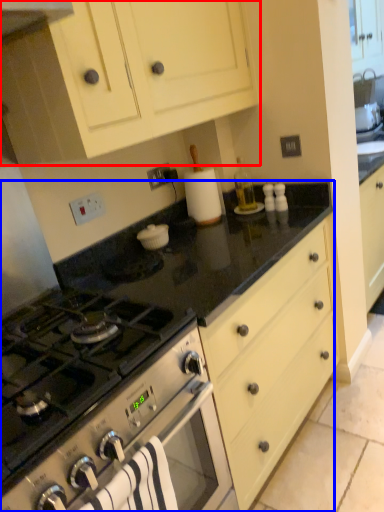
Question: Which of the following is the farthest to the observer, cabinetry (highlighted by a red box) or countertop (highlighted by a blue box)?

Choices:
 (A) cabinetry
 (B) countertop

Answer: (B)